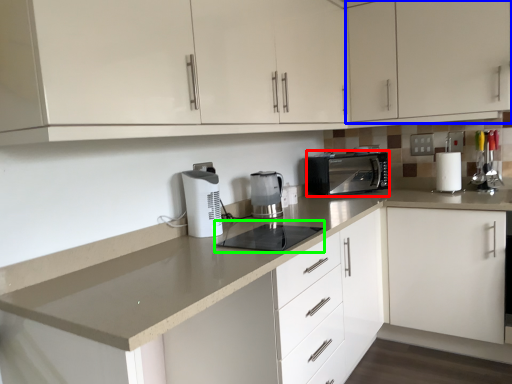
Question: Which object is the farthest from kitchen appliance (highlighted by a red box)? Choose among these: cabinetry (highlighted by a blue box) or appliance (highlighted by a green box).

Choices:
 (A) cabinetry
 (B) appliance

Answer: (B)